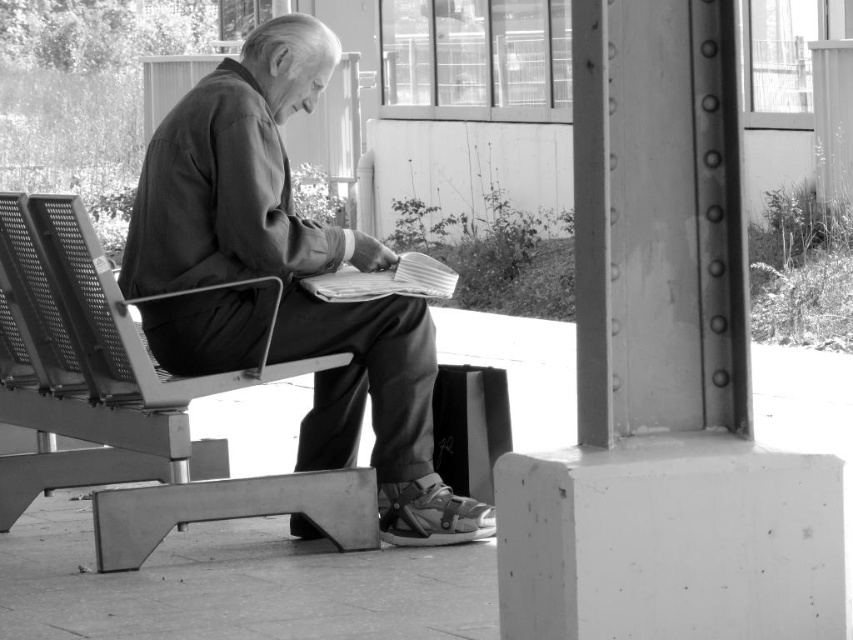
Question: Can you confirm if smooth concrete pillar at right is positioned above metallic mesh chair at left?

Choices:
 (A) yes
 (B) no

Answer: (A)

Question: Which point appears closest to the camera in this image?

Choices:
 (A) (646, 381)
 (B) (242, 136)

Answer: (A)

Question: Can you confirm if matte black jacket at center is thinner than metallic mesh chair at left?

Choices:
 (A) no
 (B) yes

Answer: (B)

Question: Which of the following is the closest to the observer?

Choices:
 (A) (321, 248)
 (B) (613, 616)

Answer: (B)

Question: From the image, what is the correct spatial relationship of matte black jacket at center in relation to metallic mesh chair at left?

Choices:
 (A) right
 (B) left

Answer: (A)

Question: Which object is the farthest from the metallic mesh chair at left?

Choices:
 (A) smooth concrete pillar at right
 (B) matte black jacket at center

Answer: (A)